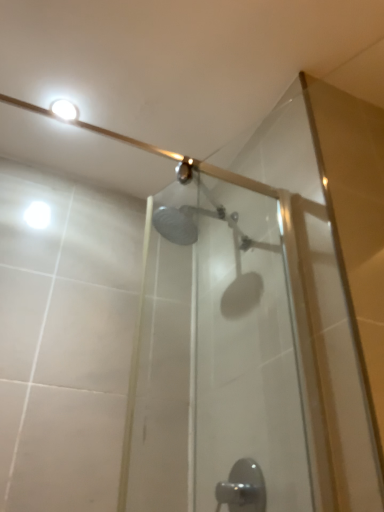
Where is `white glossy light fixture at upper left`? The image size is (384, 512). white glossy light fixture at upper left is located at coordinates (65, 109).

Describe the element at coordinates (65, 109) in the screenshot. I see `white glossy light fixture at upper left` at that location.

This screenshot has width=384, height=512. Describe the element at coordinates (243, 488) in the screenshot. I see `satin nickel faucet at lower center` at that location.

In order to face satin nickel faucet at lower center, should I rotate leftwards or rightwards?

A 5.590 degree turn to the right will do.

Locate an element on the screen. The width and height of the screenshot is (384, 512). satin nickel faucet at lower center is located at coordinates (243, 488).

What is the approximate width of satin nickel faucet at lower center?

It is 2.87 inches.

Identify the location of white glossy light fixture at upper left. The width and height of the screenshot is (384, 512). (65, 109).

Can you confirm if white glossy light fixture at upper left is positioned to the right of satin nickel faucet at lower center?

In fact, white glossy light fixture at upper left is to the left of satin nickel faucet at lower center.

Is the position of white glossy light fixture at upper left less distant than that of satin nickel faucet at lower center?

That is False.

Which is behind, point (68, 105) or point (260, 510)?

The point (68, 105) is farther from the camera.

From the image's perspective, which is below, white glossy light fixture at upper left or satin nickel faucet at lower center?

From the image's view, satin nickel faucet at lower center is below.

From a real-world perspective, is white glossy light fixture at upper left beneath satin nickel faucet at lower center?

No, from a real-world perspective, white glossy light fixture at upper left is not beneath satin nickel faucet at lower center.

Considering the relative sizes of white glossy light fixture at upper left and satin nickel faucet at lower center in the image provided, is white glossy light fixture at upper left wider than satin nickel faucet at lower center?

Yes.

Does white glossy light fixture at upper left have a lesser height compared to satin nickel faucet at lower center?

Indeed, white glossy light fixture at upper left has a lesser height compared to satin nickel faucet at lower center.

Which of these two, white glossy light fixture at upper left or satin nickel faucet at lower center, is bigger?

With larger size is satin nickel faucet at lower center.

Is white glossy light fixture at upper left not inside satin nickel faucet at lower center?

white glossy light fixture at upper left lies outside satin nickel faucet at lower center's area.

Is white glossy light fixture at upper left next to satin nickel faucet at lower center and touching it?

white glossy light fixture at upper left and satin nickel faucet at lower center are clearly separated.

Does white glossy light fixture at upper left turn towards satin nickel faucet at lower center?

No, white glossy light fixture at upper left is not turned towards satin nickel faucet at lower center.

Measure the distance between white glossy light fixture at upper left and satin nickel faucet at lower center.

They are 1.05 meters apart.

This screenshot has width=384, height=512. What are the coordinates of `light fixture on the left of satin nickel faucet at lower center` in the screenshot? It's located at (65, 109).

Which is more to the right, satin nickel faucet at lower center or white glossy light fixture at upper left?

Positioned to the right is satin nickel faucet at lower center.

Does satin nickel faucet at lower center lie behind white glossy light fixture at upper left?

No, satin nickel faucet at lower center is closer to the viewer.

Does point (227, 492) appear closer or farther from the camera than point (60, 110)?

Point (227, 492) appears to be farther away from the viewer than point (60, 110).

From the image's perspective, is satin nickel faucet at lower center below white glossy light fixture at upper left?

Indeed, from the image's perspective, satin nickel faucet at lower center is shown beneath white glossy light fixture at upper left.

From a real-world perspective, does satin nickel faucet at lower center sit lower than white glossy light fixture at upper left?

Yes, from a real-world perspective, satin nickel faucet at lower center is beneath white glossy light fixture at upper left.

Is satin nickel faucet at lower center wider or thinner than white glossy light fixture at upper left?

Clearly, satin nickel faucet at lower center has less width compared to white glossy light fixture at upper left.

Is satin nickel faucet at lower center taller or shorter than white glossy light fixture at upper left?

A: Clearly, satin nickel faucet at lower center is taller compared to white glossy light fixture at upper left.

Between satin nickel faucet at lower center and white glossy light fixture at upper left, which one has larger size?

With larger size is satin nickel faucet at lower center.

Would you say satin nickel faucet at lower center is outside white glossy light fixture at upper left?

Yes, satin nickel faucet at lower center is not within white glossy light fixture at upper left.

In the scene shown: Are satin nickel faucet at lower center and white glossy light fixture at upper left far apart?

satin nickel faucet at lower center is far away from white glossy light fixture at upper left.

Is satin nickel faucet at lower center oriented towards white glossy light fixture at upper left?

No, satin nickel faucet at lower center is not aimed at white glossy light fixture at upper left.

How many degrees apart are the facing directions of satin nickel faucet at lower center and white glossy light fixture at upper left?

They differ by 2.14 degrees in their facing directions.

The height and width of the screenshot is (512, 384). Find the location of `light fixture above the satin nickel faucet at lower center (from a real-world perspective)`. light fixture above the satin nickel faucet at lower center (from a real-world perspective) is located at coordinates (65, 109).

Find the location of a particular element. This screenshot has width=384, height=512. door handle below the white glossy light fixture at upper left (from the image's perspective) is located at coordinates (243, 488).

Where is `door handle below the white glossy light fixture at upper left (from a real-world perspective)`? This screenshot has height=512, width=384. door handle below the white glossy light fixture at upper left (from a real-world perspective) is located at coordinates (243, 488).